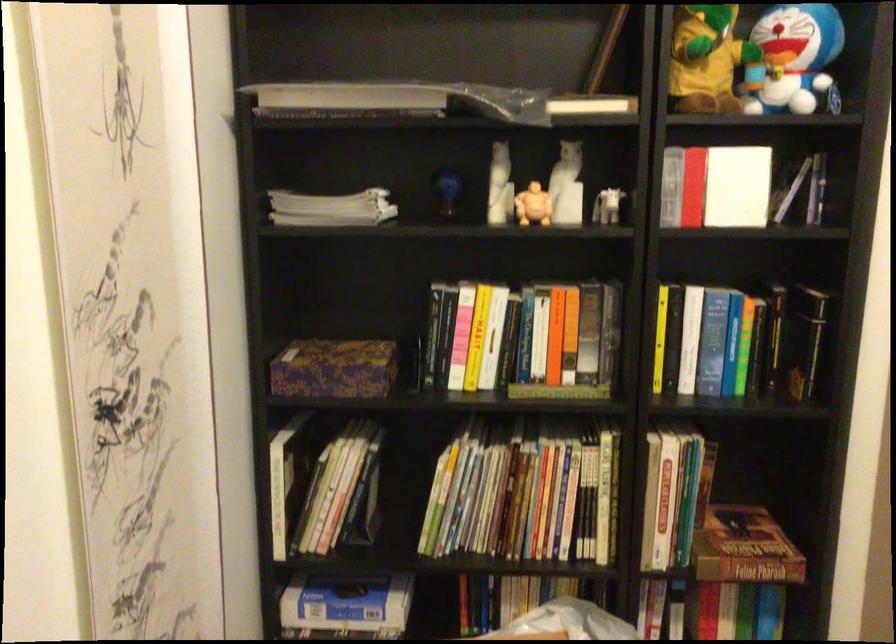
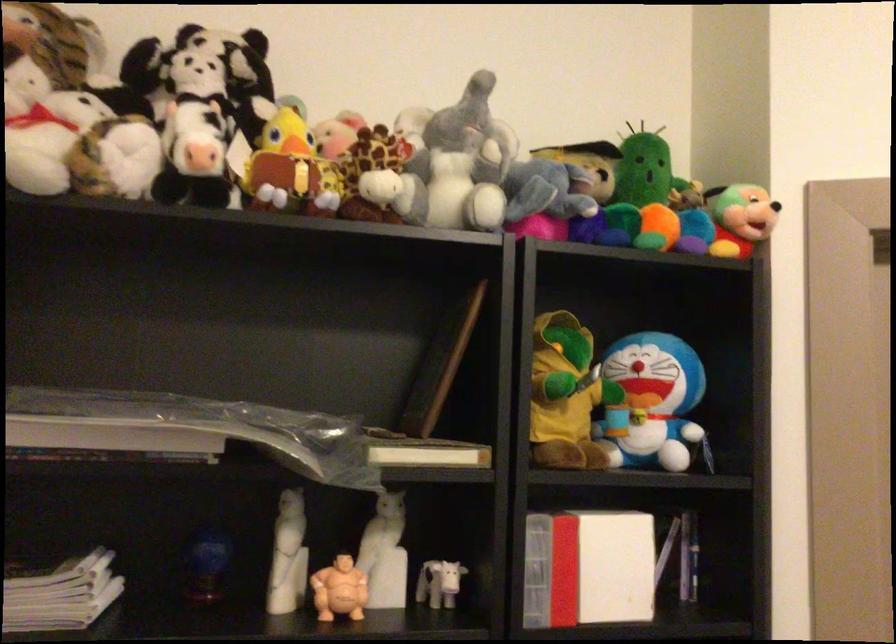
The point at (607, 204) is marked in the first image. Where is the corresponding point in the second image?

(438, 583)